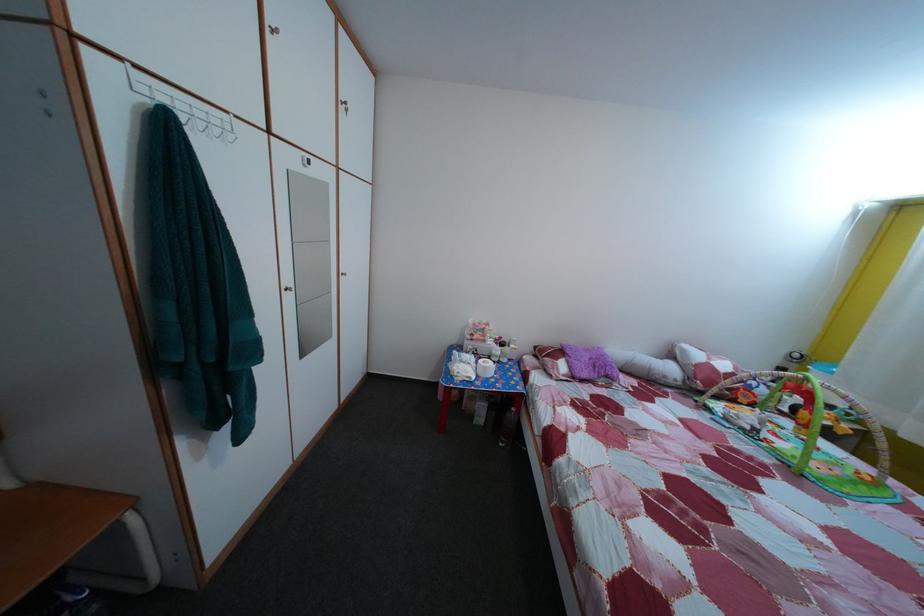
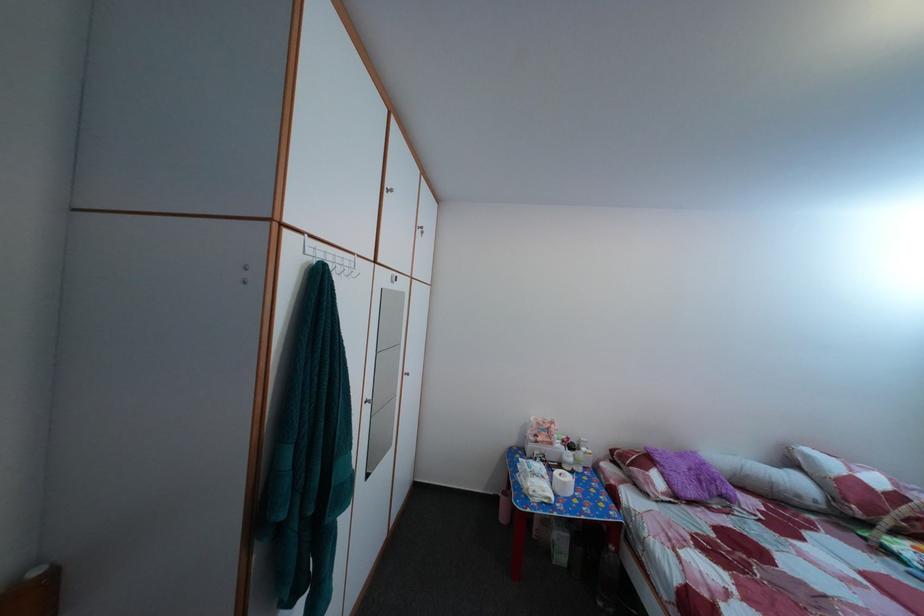
Locate, in the second image, the point that corresponds to [487,362] in the first image.

(555, 469)